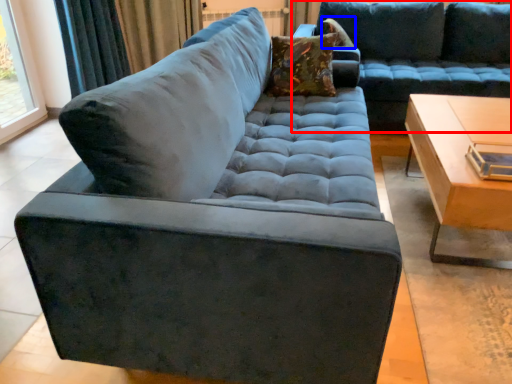
Question: Among these objects, which one is nearest to the camera, studio couch (highlighted by a red box) or pillow (highlighted by a blue box)?

Choices:
 (A) studio couch
 (B) pillow

Answer: (A)